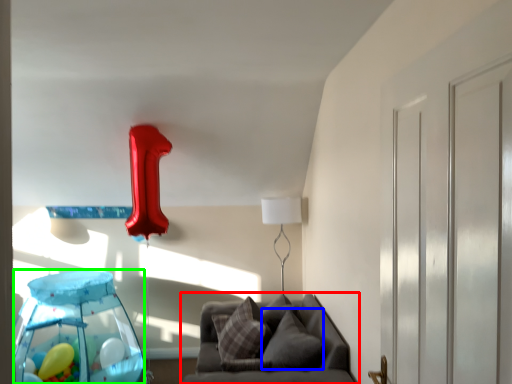
Question: Based on their relative distances, which object is nearer to furniture (highlighted by a red box)? Choose from pillow (highlighted by a blue box) and glass table (highlighted by a green box).

Choices:
 (A) pillow
 (B) glass table

Answer: (A)